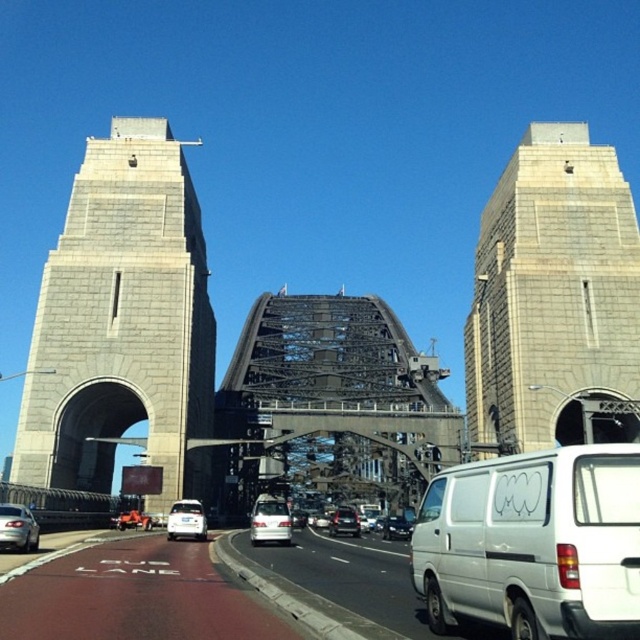
You are a drone operator planning to fly a drone between the gray stone tower at left and the satin silver van at center. The drone has a maximum flight distance of 35 meters. Can the drone safely fly between these two points without exceeding its range?

The gray stone tower at left and satin silver van at center are 38.16 meters apart. Since the drone can only fly up to 35 meters, it cannot safely fly between these two points without exceeding its range.

You are a pedestrian standing on the sidewalk near the Sydney Harbour Bridge. You see a satin silver van at center and a shiny silver sedan at center. Which vehicle is closer to you?

The satin silver van at center is closer because it is in front of the shiny silver sedan at center from your perspective.

You are standing at the Sydney Harbour Bridge and want to know how far you are from the point marked at coordinates (77, 426). Can you determine the distance?

The point marked at coordinates (77, 426) is 275.60 feet away from you.